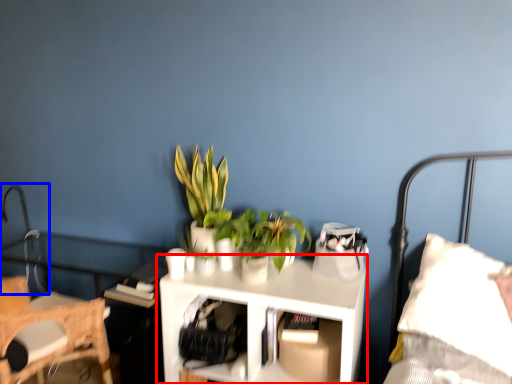
Question: Which object appears closest to the camera in this image, table (highlighted by a red box) or table lamp (highlighted by a blue box)?

Choices:
 (A) table
 (B) table lamp

Answer: (A)